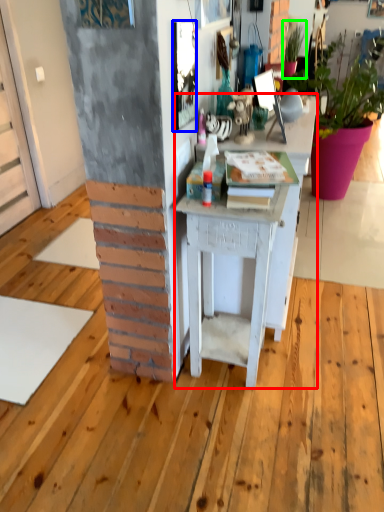
Question: Which object is the farthest from desk (highlighted by a red box)? Choose among these: picture frame (highlighted by a blue box) or houseplant (highlighted by a green box).

Choices:
 (A) picture frame
 (B) houseplant

Answer: (B)